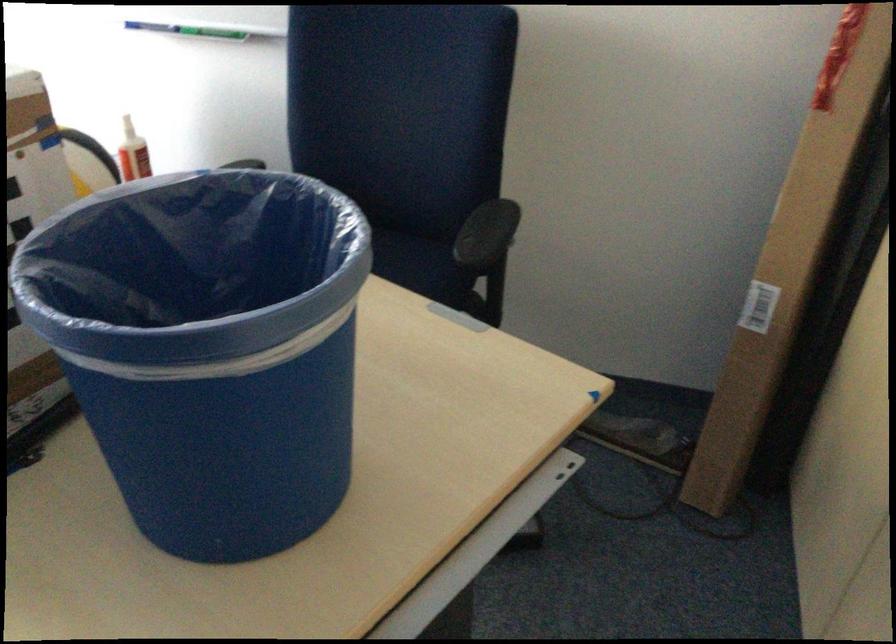
Describe the element at coordinates (488, 576) in the screenshot. This screenshot has width=896, height=644. I see `a whiteboard marker` at that location.